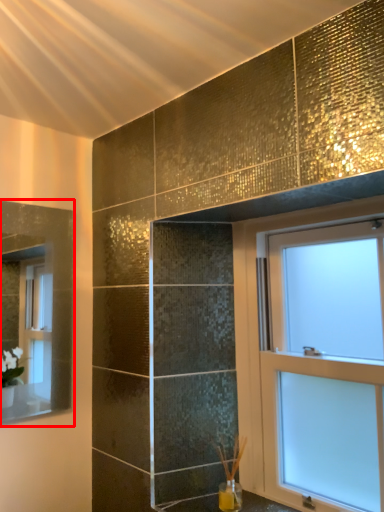
Question: Observing the image, what is the correct spatial positioning of mirror (annotated by the red box) in reference to window?

Choices:
 (A) left
 (B) right

Answer: (A)